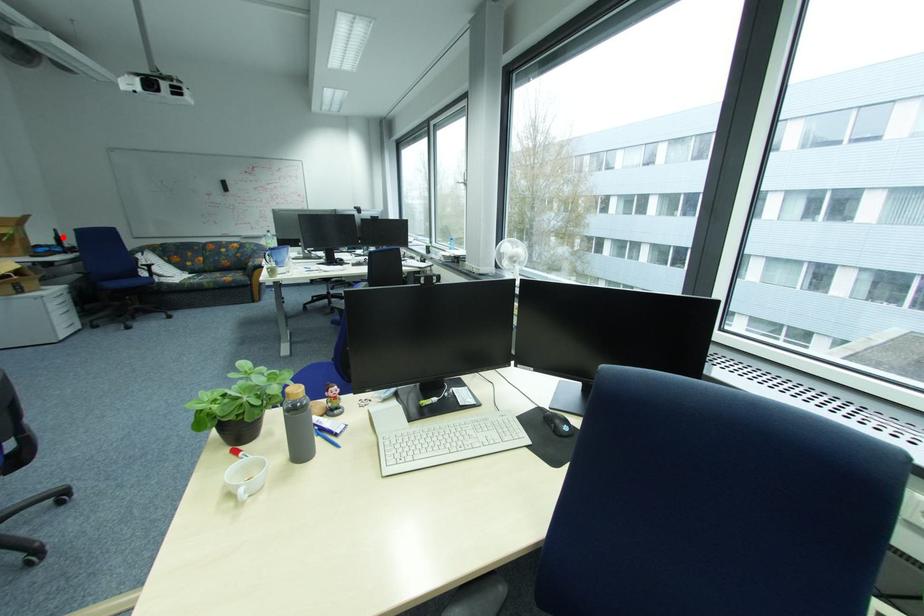
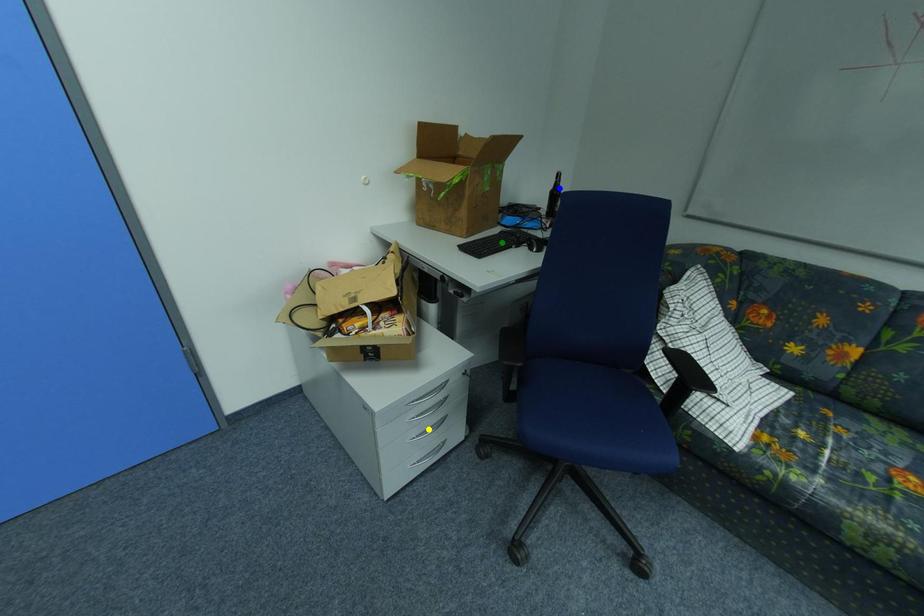
Question: I am providing you with two images of the same scene from different viewpoints. A red point is marked on the first image. You are given multiple points on the second image. Which point in image 2 is actually the same real-world point as the red point in image 1?

Choices:
 (A) blue point
 (B) yellow point
 (C) green point

Answer: (A)